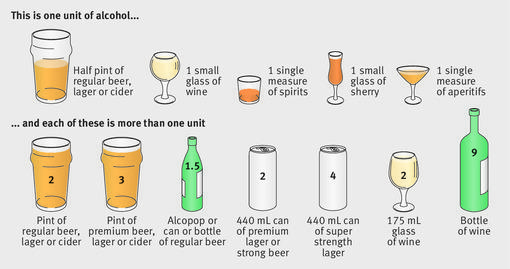
Locate an element on the screen. The height and width of the screenshot is (269, 510). 1 small glass of sherry is located at coordinates (352, 69), (376, 93).